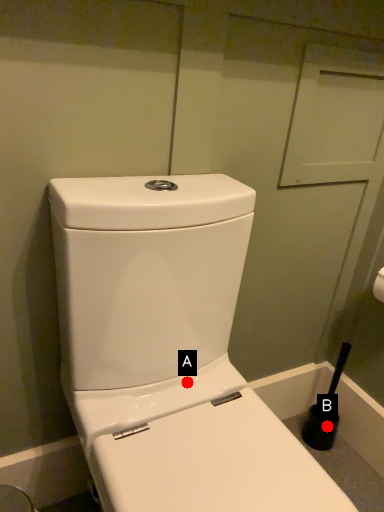
Question: Two points are circled on the image, labeled by A and B beside each circle. Which point is closer to the camera taking this photo?

Choices:
 (A) A is closer
 (B) B is closer

Answer: (A)